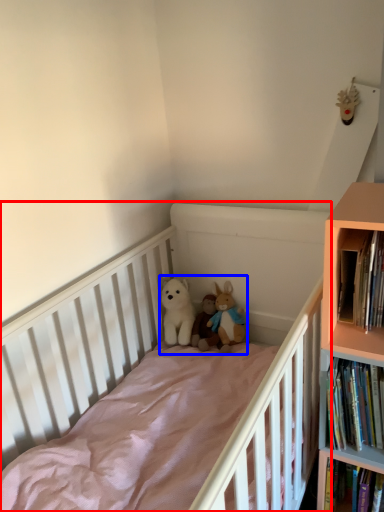
Question: Which object appears farthest to the camera in this image, infant bed (highlighted by a red box) or toy (highlighted by a blue box)?

Choices:
 (A) infant bed
 (B) toy

Answer: (B)